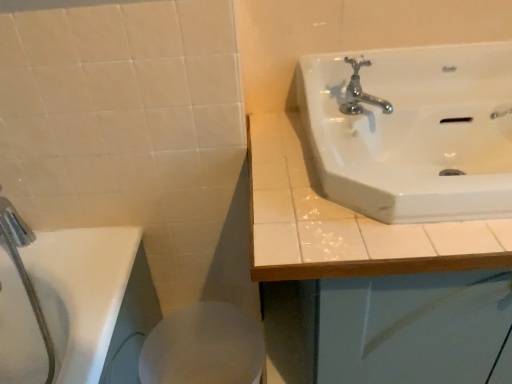
The image size is (512, 384). Identify the location of white glossy sink at upper right. (413, 130).

This screenshot has width=512, height=384. I want to click on white glossy bidet at lower center, so click(x=204, y=347).

Describe the element at coordinates (361, 92) in the screenshot. The width and height of the screenshot is (512, 384). I see `chrome metallic faucet at upper right` at that location.

Locate an element on the screen. white glossy sink at upper right is located at coordinates click(413, 130).

Is white glossy bidet at lower center facing towards white glossy sink at upper right?

No, white glossy bidet at lower center does not turn towards white glossy sink at upper right.

From the image's perspective, does white glossy bidet at lower center appear lower than white glossy sink at upper right?

Yes, from the image's perspective, white glossy bidet at lower center is beneath white glossy sink at upper right.

Is white glossy bidet at lower center to the right of white glossy sink at upper right from the viewer's perspective?

No.

Is white glossy bidet at lower center placed right next to white glossy sink at upper right?

white glossy bidet at lower center and white glossy sink at upper right are not in contact.

Consider the image. Is white glossy sink at upper right far from chrome metallic faucet at upper right?

No, white glossy sink at upper right is in close proximity to chrome metallic faucet at upper right.

Is white glossy sink at upper right not within chrome metallic faucet at upper right?

Yes.

Does point (336, 198) appear closer or farther from the camera than point (349, 89)?

Clearly, point (336, 198) is closer to the camera than point (349, 89).

Which object is thinner, white glossy sink at upper right or chrome metallic faucet at upper right?

chrome metallic faucet at upper right is thinner.

Between white glossy bidet at lower center and white glossy sink at upper right, which one is positioned in front?

white glossy sink at upper right is more forward.

In terms of width, does white glossy bidet at lower center look wider or thinner when compared to white glossy sink at upper right?

Clearly, white glossy bidet at lower center has less width compared to white glossy sink at upper right.

Is white glossy bidet at lower center smaller than white glossy sink at upper right?

Result: Yes, white glossy bidet at lower center is smaller than white glossy sink at upper right.

Considering the relative positions of white glossy bidet at lower center and white glossy sink at upper right in the image provided, is white glossy bidet at lower center to the right of white glossy sink at upper right from the viewer's perspective?

Incorrect, white glossy bidet at lower center is not on the right side of white glossy sink at upper right.

You are a GUI agent. You are given a task and a screenshot of the screen. Output one action in this format:
    pyautogui.click(x=<x>, y=<y>)
    Task: Click on the sink that appears below the chrome metallic faucet at upper right (from the image's perspective)
    This screenshot has width=512, height=384.
    Given the screenshot: What is the action you would take?
    pyautogui.click(x=413, y=130)

Can you confirm if chrome metallic faucet at upper right is positioned to the right of white glossy sink at upper right?

In fact, chrome metallic faucet at upper right is to the left of white glossy sink at upper right.

Does point (359, 85) come in front of point (397, 200)?

No, (359, 85) is further to viewer.

Is white glossy sink at upper right to the right of white glossy bidet at lower center from the viewer's perspective?

Yes, white glossy sink at upper right is to the right of white glossy bidet at lower center.

Between white glossy sink at upper right and white glossy bidet at lower center, which one has less height?

With less height is white glossy bidet at lower center.

Is white glossy sink at upper right next to white glossy bidet at lower center?

white glossy sink at upper right and white glossy bidet at lower center are not in contact.

Which object is thinner, white glossy sink at upper right or white glossy bidet at lower center?

Thinner between the two is white glossy bidet at lower center.

Identify the location of sink positioned vertically above the white glossy bidet at lower center (from a real-world perspective). (413, 130).

From the picture: Is white glossy sink at upper right further to camera compared to white glossy bidet at lower center?

No, the depth of white glossy sink at upper right is less than that of white glossy bidet at lower center.

Measure the distance from white glossy sink at upper right to white glossy bidet at lower center.

white glossy sink at upper right and white glossy bidet at lower center are 24.66 inches apart from each other.

Does white glossy bidet at lower center turn towards chrome metallic faucet at upper right?

No, white glossy bidet at lower center is not aimed at chrome metallic faucet at upper right.

From the picture: Between white glossy bidet at lower center and chrome metallic faucet at upper right, which one has less height?

chrome metallic faucet at upper right.

Does white glossy bidet at lower center have a greater width compared to chrome metallic faucet at upper right?

Correct, the width of white glossy bidet at lower center exceeds that of chrome metallic faucet at upper right.

Would you consider white glossy bidet at lower center to be distant from chrome metallic faucet at upper right?

No, white glossy bidet at lower center is not far away from chrome metallic faucet at upper right.

You are a GUI agent. You are given a task and a screenshot of the screen. Output one action in this format:
    pyautogui.click(x=<x>, y=<y>)
    Task: Click on the counter top above the white glossy bidet at lower center (from a real-world perspective)
    
    Given the screenshot: What is the action you would take?
    pyautogui.click(x=343, y=221)

Identify the location of tap located behind the white glossy sink at upper right. (361, 92).

Which object lies further to the anchor point white glossy sink at upper right, white glossy sink at upper right or white glossy bidet at lower center?

Based on the image, white glossy bidet at lower center appears to be further to white glossy sink at upper right.

Estimate the real-world distances between objects in this image. Which object is further from chrome metallic faucet at upper right, white glossy sink at upper right or white glossy bidet at lower center?

white glossy bidet at lower center is positioned further to the anchor chrome metallic faucet at upper right.

When comparing their distances from white glossy sink at upper right, does chrome metallic faucet at upper right or white glossy sink at upper right seem further?

chrome metallic faucet at upper right is further to white glossy sink at upper right.

Looking at the image, which one is located further to white glossy bidet at lower center, white glossy sink at upper right or white glossy sink at upper right?

white glossy sink at upper right.

When comparing their distances from white glossy bidet at lower center, does white glossy sink at upper right or chrome metallic faucet at upper right seem further?

chrome metallic faucet at upper right is further to white glossy bidet at lower center.

Estimate the real-world distances between objects in this image. Which object is further from white glossy sink at upper right, white glossy sink at upper right or chrome metallic faucet at upper right?

Based on the image, white glossy sink at upper right appears to be further to white glossy sink at upper right.

Based on the photo, considering their positions, is white glossy bidet at lower center positioned further to white glossy sink at upper right than chrome metallic faucet at upper right?

Among the two, white glossy bidet at lower center is located further to white glossy sink at upper right.

Which object lies further to the anchor point white glossy sink at upper right, white glossy bidet at lower center or white glossy sink at upper right?

Among the two, white glossy bidet at lower center is located further to white glossy sink at upper right.

Identify the location of counter top between chrome metallic faucet at upper right and white glossy bidet at lower center in the up-down direction. The height and width of the screenshot is (384, 512). (343, 221).

The width and height of the screenshot is (512, 384). What are the coordinates of `counter top between white glossy sink at upper right and white glossy bidet at lower center in the vertical direction` in the screenshot? It's located at (343, 221).

What are the coordinates of `sink between chrome metallic faucet at upper right and white glossy sink at upper right in the vertical direction` in the screenshot? It's located at (413, 130).

What are the coordinates of `sink that lies between chrome metallic faucet at upper right and white glossy bidet at lower center from top to bottom` in the screenshot? It's located at (413, 130).